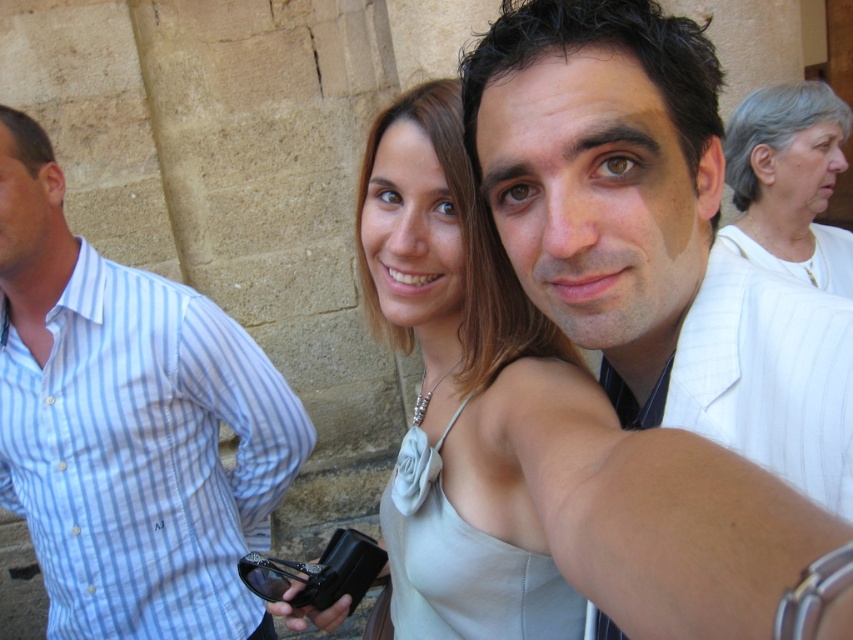
You are a photographer trying to capture a candid shot of the blue striped shirt at left and the white fabric at upper right. Based on their positions, which object is closer to the bottom of the frame?

The blue striped shirt at left is located below the white fabric at upper right, so it is closer to the bottom of the frame.

You are standing at the point with coordinates point (363, 556) and want to move towards the point with coordinates point (851, 113). Which direction should you move in?

You should move backward because point (851, 113) is behind point (363, 556).